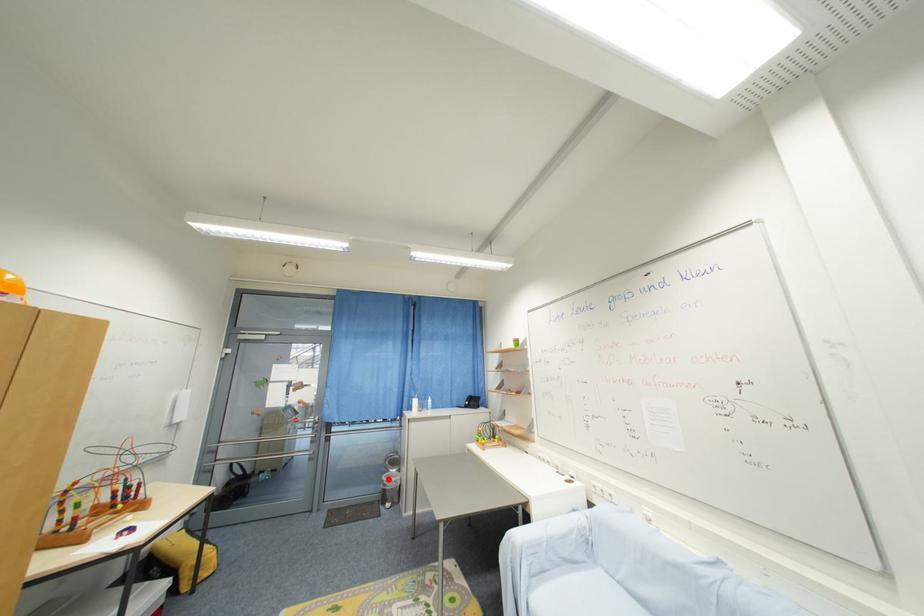
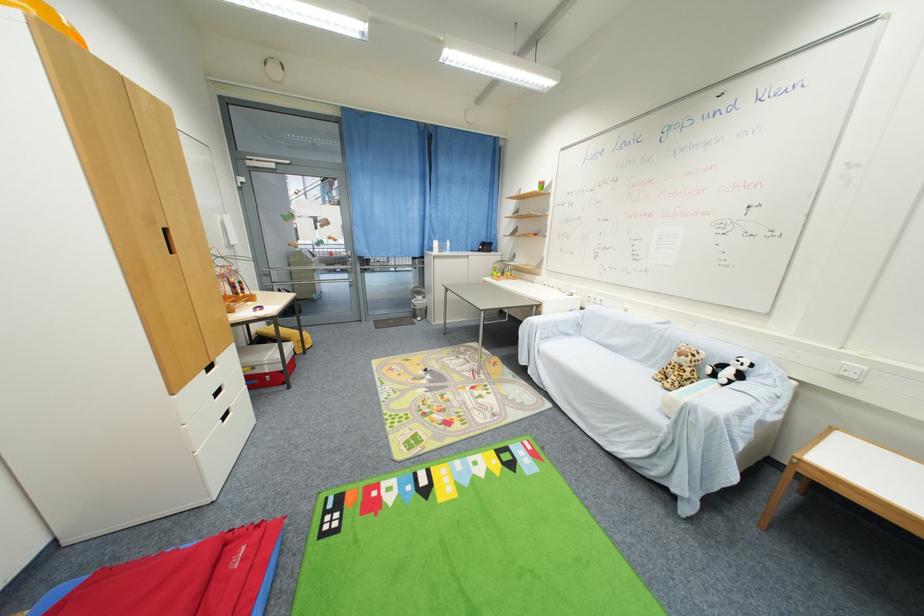
Where in the second image is the point corresponding to the highlighted location from the first image?

(418, 302)